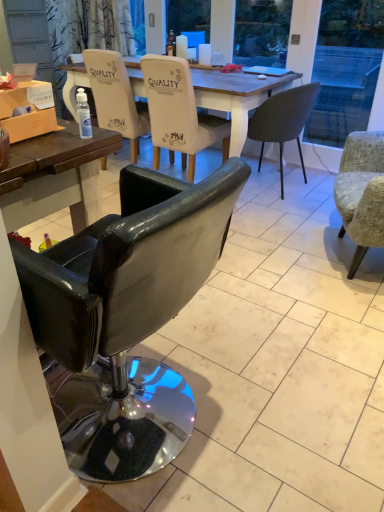
Question: Considering the relative positions of textured gray armchair at right, the second chair when ordered from front to back, and matte dark gray chair at center, which appears as the 2th chair when viewed from the back, in the image provided, is textured gray armchair at right, the second chair when ordered from front to back, to the right of matte dark gray chair at center, which appears as the 2th chair when viewed from the back, from the viewer's perspective?

Choices:
 (A) no
 (B) yes

Answer: (B)

Question: Is textured gray armchair at right, the second chair when ordered from front to back, taller than matte dark gray chair at center, which appears as the 2th chair when viewed from the back?

Choices:
 (A) yes
 (B) no

Answer: (A)

Question: Is textured gray armchair at right, the second chair when ordered from front to back, turned away from matte dark gray chair at center, acting as the fourth chair starting from the front?

Choices:
 (A) yes
 (B) no

Answer: (B)

Question: Does textured gray armchair at right, marked as the fourth chair in a back-to-front arrangement, appear on the left side of matte dark gray chair at center, which appears as the 2th chair when viewed from the back?

Choices:
 (A) yes
 (B) no

Answer: (B)

Question: From the image's perspective, is textured gray armchair at right, the second chair when ordered from front to back, above matte dark gray chair at center, acting as the fourth chair starting from the front?

Choices:
 (A) yes
 (B) no

Answer: (B)

Question: Is textured gray armchair at right, the second chair when ordered from front to back, smaller than matte dark gray chair at center, which appears as the 2th chair when viewed from the back?

Choices:
 (A) no
 (B) yes

Answer: (A)

Question: Is the surface of matte dark gray chair at center, which appears as the 2th chair when viewed from the back, in direct contact with matte white chair at center, placed as the 5th chair when sorted from front to back?

Choices:
 (A) no
 (B) yes

Answer: (A)

Question: Considering the relative positions of matte dark gray chair at center, which appears as the 2th chair when viewed from the back, and matte white chair at center, the first chair viewed from the back, in the image provided, is matte dark gray chair at center, which appears as the 2th chair when viewed from the back, to the right of matte white chair at center, the first chair viewed from the back, from the viewer's perspective?

Choices:
 (A) no
 (B) yes

Answer: (B)

Question: From a real-world perspective, is matte dark gray chair at center, acting as the fourth chair starting from the front, over matte white chair at center, the first chair viewed from the back?

Choices:
 (A) no
 (B) yes

Answer: (A)

Question: Is matte dark gray chair at center, acting as the fourth chair starting from the front, facing towards matte white chair at center, the first chair viewed from the back?

Choices:
 (A) no
 (B) yes

Answer: (B)

Question: Is the position of matte dark gray chair at center, acting as the fourth chair starting from the front, more distant than that of matte white chair at center, the first chair viewed from the back?

Choices:
 (A) yes
 (B) no

Answer: (B)

Question: Would you consider matte dark gray chair at center, which appears as the 2th chair when viewed from the back, to be distant from matte white chair at center, the first chair viewed from the back?

Choices:
 (A) no
 (B) yes

Answer: (B)

Question: Is matte white chair at center, the first chair viewed from the back, not inside matte white coffee cup at upper center, which is the 1th coffee cup from right to left?

Choices:
 (A) yes
 (B) no

Answer: (A)